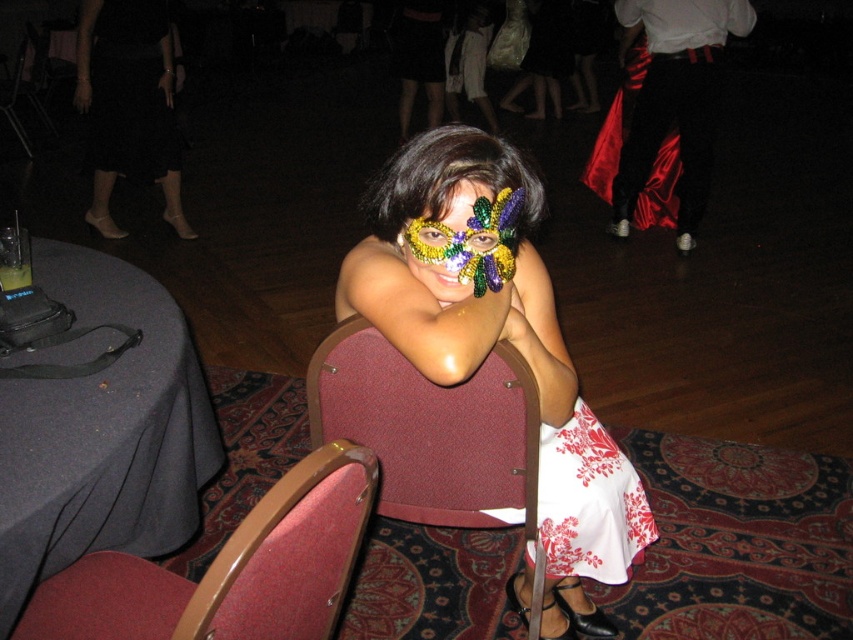
Question: Is sequined mask at center thinner than black satin dress at upper left?

Choices:
 (A) yes
 (B) no

Answer: (B)

Question: Which object is the farthest from the black fabric table at lower left?

Choices:
 (A) velvet red chair at lower left
 (B) black satin dress at upper left

Answer: (B)

Question: Which point is farther to the camera?

Choices:
 (A) maroon fabric chair at center
 (B) shiny sequined mask at center

Answer: (A)

Question: Is black fabric table at lower left wider than black satin dress at upper left?

Choices:
 (A) no
 (B) yes

Answer: (B)

Question: Can you confirm if velvet red chair at lower left is thinner than shiny sequined mask at center?

Choices:
 (A) yes
 (B) no

Answer: (B)

Question: Which point is farther from the camera taking this photo?

Choices:
 (A) (100, 13)
 (B) (157, 304)
 (C) (119, 588)

Answer: (A)